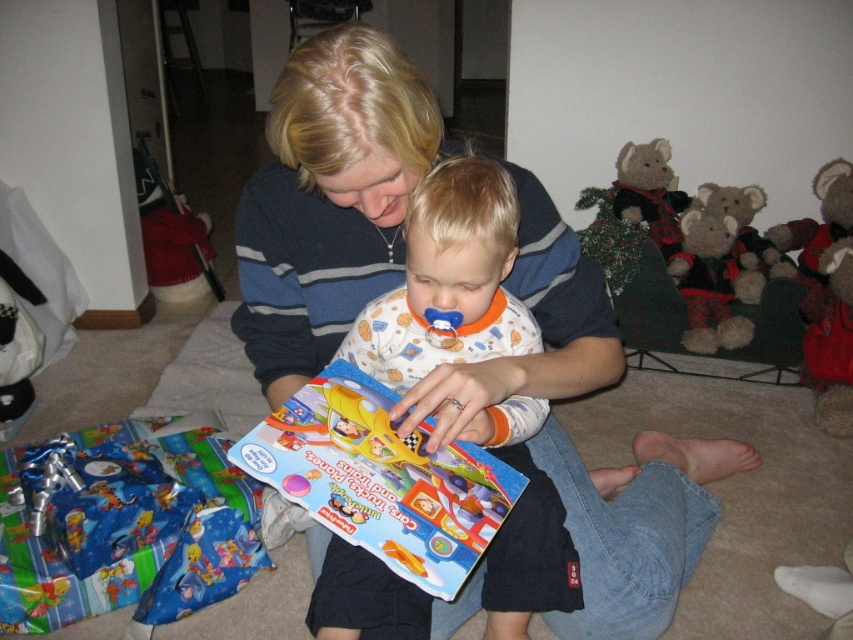
Question: Is matte plastic book at center positioned behind flannel plush bear at right?

Choices:
 (A) yes
 (B) no

Answer: (B)

Question: Which point is farther from the camera taking this photo?

Choices:
 (A) 344,81
 (B) 402,492

Answer: (B)

Question: Based on their relative distances, which object is nearer to the white cotton onesie at center?

Choices:
 (A) matte blue sweater at center
 (B) matte plastic book at center

Answer: (B)

Question: Based on their relative distances, which object is nearer to the matte blue sweater at center?

Choices:
 (A) matte plastic book at center
 (B) white cotton onesie at center

Answer: (B)

Question: Can you confirm if matte blue sweater at center is positioned to the left of flannel plush bear at right?

Choices:
 (A) yes
 (B) no

Answer: (A)

Question: Is the position of matte plastic book at center more distant than that of flannel plush bear at right?

Choices:
 (A) yes
 (B) no

Answer: (B)